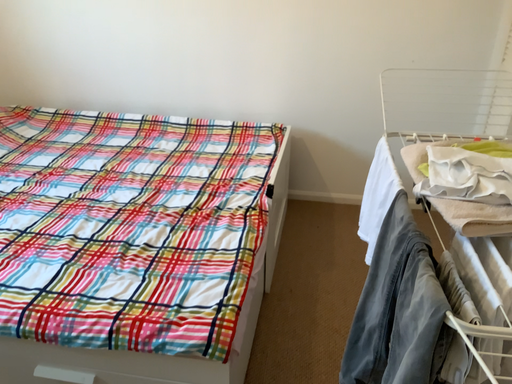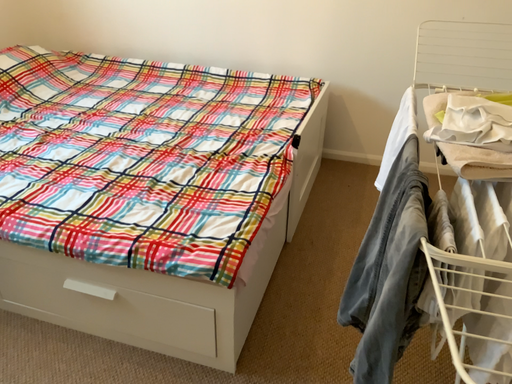
Question: How did the camera likely rotate when shooting the video?

Choices:
 (A) rotated left
 (B) rotated right

Answer: (A)